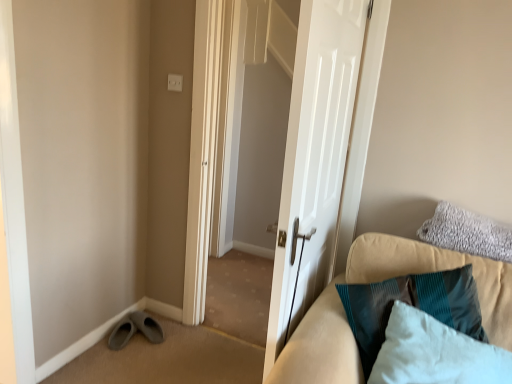
What do you see at coordinates (378, 281) in the screenshot?
I see `teal fabric couch at right` at bounding box center [378, 281].

At what (x,y) coordinates should I click in order to perform the action: click on teal fabric couch at right. Please return your answer as a coordinate pair (x, y). The width and height of the screenshot is (512, 384). Looking at the image, I should click on (378, 281).

The height and width of the screenshot is (384, 512). Describe the element at coordinates (467, 233) in the screenshot. I see `gray fluffy pillow at upper right, placed as the 2th pillow when sorted from front to back` at that location.

The height and width of the screenshot is (384, 512). What do you see at coordinates (246, 90) in the screenshot?
I see `white glossy door at center` at bounding box center [246, 90].

The width and height of the screenshot is (512, 384). I want to click on white glossy door at center, so click(x=314, y=158).

Considering the relative positions of white soft pillow at lower right, the second pillow viewed from the back, and white glossy door at center in the image provided, is white soft pillow at lower right, the second pillow viewed from the back, to the left or to the right of white glossy door at center?

In the image, white soft pillow at lower right, the second pillow viewed from the back, appears on the right side of white glossy door at center.

Which object is further away from the camera taking this photo, white soft pillow at lower right, the second pillow viewed from the back, or white glossy door at center?

white glossy door at center is further away from the camera.

From the image's perspective, is white soft pillow at lower right, the second pillow viewed from the back, positioned above or below white glossy door at center?

white soft pillow at lower right, the second pillow viewed from the back, is below white glossy door at center.

Considering the relative sizes of white soft pillow at lower right, the 1th pillow viewed from the front, and white glossy door at center in the image provided, is white soft pillow at lower right, the 1th pillow viewed from the front, bigger than white glossy door at center?

Incorrect, white soft pillow at lower right, the 1th pillow viewed from the front, is not larger than white glossy door at center.

Is white glossy door at center at the back of white glossy door at center?

No, white glossy door at center's orientation is not away from white glossy door at center.

Is white glossy door at center to the left or to the right of white glossy door at center in the image?

Clearly, white glossy door at center is on the left of white glossy door at center in the image.

Is white glossy door at center located outside white glossy door at center?

Yes.

Relative to white glossy door at center, is white glossy door at center in front or behind?

Result: Visually, white glossy door at center is located behind white glossy door at center.

Looking at this image, which is closer to the camera, (489,244) or (488,367)?

The point (488,367) is closer.

Considering the positions of objects gray fluffy pillow at upper right, which is the second pillow from bottom to top, and white soft pillow at lower right, marked as the second pillow in a top-to-bottom arrangement, in the image provided, who is in front, gray fluffy pillow at upper right, which is the second pillow from bottom to top, or white soft pillow at lower right, marked as the second pillow in a top-to-bottom arrangement,?

white soft pillow at lower right, marked as the second pillow in a top-to-bottom arrangement.

In the image, is gray fluffy pillow at upper right, the first pillow from the back, on the left side or the right side of white soft pillow at lower right, the second pillow viewed from the back?

Based on their positions, gray fluffy pillow at upper right, the first pillow from the back, is located to the right of white soft pillow at lower right, the second pillow viewed from the back.

Between teal fabric couch at right and gray suede shoe at lower left, which one has more height?

teal fabric couch at right.

From a real-world perspective, is teal fabric couch at right physically above gray suede shoe at lower left?

Yes.

Consider the image. Does teal fabric couch at right appear on the right side of gray suede shoe at lower left?

Yes, teal fabric couch at right is to the right of gray suede shoe at lower left.

Is gray suede shoe at lower left inside teal fabric couch at right?

Definitely not — gray suede shoe at lower left is not inside teal fabric couch at right.

How different are the orientations of white soft pillow at lower right, the 1th pillow viewed from the front, and gray fluffy pillow at upper right, acting as the 1th pillow starting from the top, in degrees?

The facing directions of white soft pillow at lower right, the 1th pillow viewed from the front, and gray fluffy pillow at upper right, acting as the 1th pillow starting from the top, are 0.00014 degrees apart.

Is white soft pillow at lower right, the second pillow viewed from the back, spatially inside gray fluffy pillow at upper right, acting as the 1th pillow starting from the top, or outside of it?

white soft pillow at lower right, the second pillow viewed from the back, is located beyond the bounds of gray fluffy pillow at upper right, acting as the 1th pillow starting from the top.

From a real-world perspective, is white soft pillow at lower right, marked as the second pillow in a top-to-bottom arrangement, positioned above or below gray fluffy pillow at upper right, placed as the 2th pillow when sorted from front to back?

From a real-world perspective, white soft pillow at lower right, marked as the second pillow in a top-to-bottom arrangement, is physically below gray fluffy pillow at upper right, placed as the 2th pillow when sorted from front to back.

Is point (377, 383) positioned behind point (459, 234)?

That is False.

Can you confirm if gray suede shoe at lower left is smaller than white glossy door at center?

Indeed, gray suede shoe at lower left has a smaller size compared to white glossy door at center.

Is gray suede shoe at lower left positioned far away from white glossy door at center?

Absolutely, gray suede shoe at lower left is distant from white glossy door at center.

Is white glossy door at center at the back of gray suede shoe at lower left?

No, white glossy door at center is not at the back of gray suede shoe at lower left.

I want to click on shoe below the white glossy door at center (from the image's perspective), so click(x=135, y=330).

From a real-world perspective, which is physically below, teal fabric couch at right or white glossy door at center?

teal fabric couch at right, from a real-world perspective.

Is point (404, 244) closer or farther from the camera than point (229, 67)?

Point (404, 244) appears to be closer to the viewer than point (229, 67).

Does teal fabric couch at right have a lesser height compared to white glossy door at center?

Correct, teal fabric couch at right is not as tall as white glossy door at center.

Identify the location of the 2nd pillow below when counting from the white glossy door at center (from the image's perspective). (435, 353).

Where is `screen door lying behind the white glossy door at center`? This screenshot has height=384, width=512. screen door lying behind the white glossy door at center is located at coordinates (246, 90).

When comparing their distances from white soft pillow at lower right, marked as the second pillow in a top-to-bottom arrangement, does gray suede shoe at lower left or white glossy door at center seem closer?

gray suede shoe at lower left.

When comparing their distances from teal fabric couch at right, does gray fluffy pillow at upper right, placed as the 2th pillow when sorted from front to back, or white glossy door at center seem closer?

gray fluffy pillow at upper right, placed as the 2th pillow when sorted from front to back, is closer to teal fabric couch at right.

Based on the photo, looking at the image, which one is located closer to white soft pillow at lower right, marked as the first pillow in a bottom-to-top arrangement, gray suede shoe at lower left or teal fabric couch at right?

teal fabric couch at right is positioned closer to the anchor white soft pillow at lower right, marked as the first pillow in a bottom-to-top arrangement.

When comparing their distances from gray suede shoe at lower left, does gray fluffy pillow at upper right, the first pillow from the back, or white soft pillow at lower right, marked as the first pillow in a bottom-to-top arrangement, seem further?

gray fluffy pillow at upper right, the first pillow from the back, is positioned further to the anchor gray suede shoe at lower left.

Which object lies further to the anchor point white glossy door at center, white glossy door at center or white soft pillow at lower right, the second pillow viewed from the back?

white soft pillow at lower right, the second pillow viewed from the back, lies further to white glossy door at center than the other object.

Estimate the real-world distances between objects in this image. Which object is closer to white glossy door at center, white glossy door at center or gray suede shoe at lower left?

Among the two, white glossy door at center is located nearer to white glossy door at center.

Estimate the real-world distances between objects in this image. Which object is closer to white glossy door at center, white soft pillow at lower right, the 1th pillow viewed from the front, or gray fluffy pillow at upper right, which is the second pillow from bottom to top?

Among the two, gray fluffy pillow at upper right, which is the second pillow from bottom to top, is located nearer to white glossy door at center.

From the image, which object appears to be nearer to white soft pillow at lower right, marked as the first pillow in a bottom-to-top arrangement, gray fluffy pillow at upper right, the first pillow from the back, or gray suede shoe at lower left?

gray fluffy pillow at upper right, the first pillow from the back, is closer to white soft pillow at lower right, marked as the first pillow in a bottom-to-top arrangement.

Image resolution: width=512 pixels, height=384 pixels. Identify the location of studio couch between white glossy door at center and white glossy door at center along the z-axis. (378, 281).

Locate an element on the screen. The width and height of the screenshot is (512, 384). studio couch between white soft pillow at lower right, the 1th pillow viewed from the front, and white glossy door at center from front to back is located at coordinates (378, 281).

This screenshot has width=512, height=384. I want to click on door located between gray suede shoe at lower left and gray fluffy pillow at upper right, the first pillow from the back, in the left-right direction, so click(x=314, y=158).

Where is `studio couch between white glossy door at center and gray fluffy pillow at upper right, which is the second pillow from bottom to top, in the horizontal direction`? This screenshot has width=512, height=384. studio couch between white glossy door at center and gray fluffy pillow at upper right, which is the second pillow from bottom to top, in the horizontal direction is located at coordinates (378, 281).